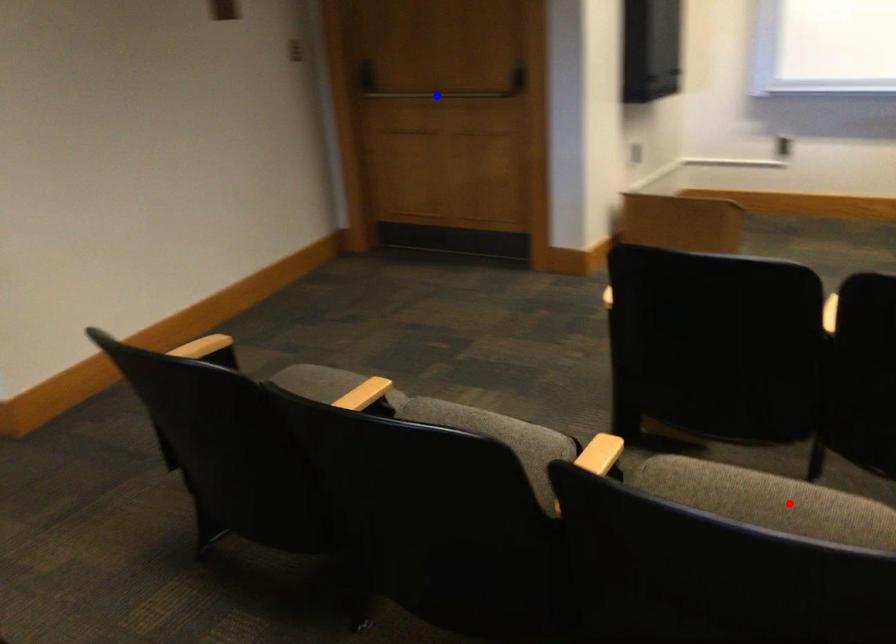
Question: In the image, two points are highlighted. Which point is nearer to the camera? Reply with the corresponding letter.

Choices:
 (A) blue point
 (B) red point

Answer: (B)